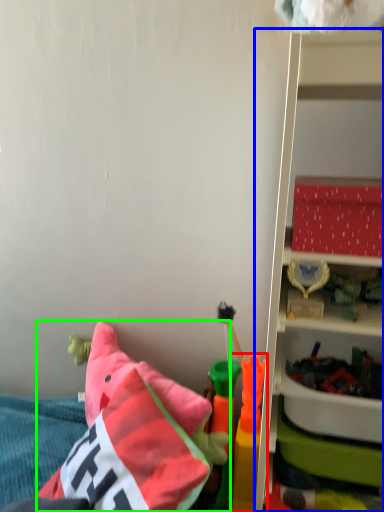
Question: Based on their relative distances, which object is farther from toy (highlighted by a red box)? Choose from shelf (highlighted by a blue box) and pillow (highlighted by a green box).

Choices:
 (A) shelf
 (B) pillow

Answer: (A)